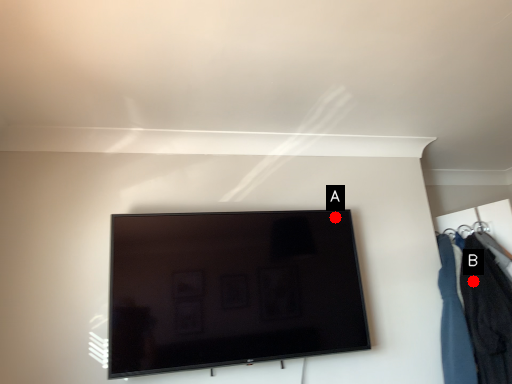
Question: Two points are circled on the image, labeled by A and B beside each circle. Among these points, which one is nearest to the camera?

Choices:
 (A) A is closer
 (B) B is closer

Answer: (A)